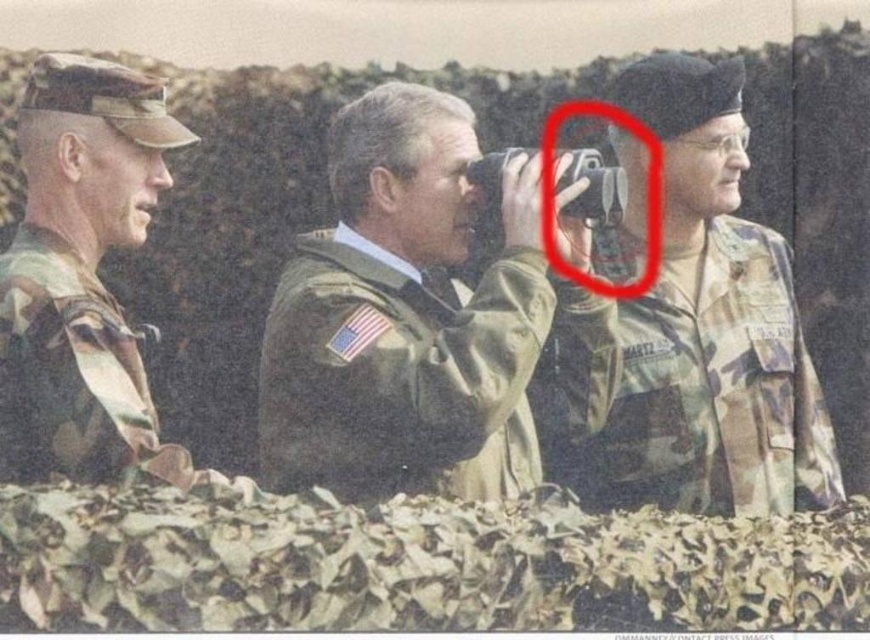
Is point (353, 100) farther from camera compared to point (168, 134)?

Yes.

Identify the location of camouflage jacket at center. (405, 317).

Locate an element on the screen. The width and height of the screenshot is (870, 640). camouflage jacket at center is located at coordinates (405, 317).

Measure the distance between point (717, 486) and camera.

A distance of 6.33 meters exists between point (717, 486) and camera.

Is camo fabric uniform at center wider than camo uniform at left?

Yes, camo fabric uniform at center is wider than camo uniform at left.

Is point (696, 403) positioned after point (152, 93)?

Yes, it is.

The image size is (870, 640). I want to click on camo fabric uniform at center, so click(693, 392).

Can you confirm if camouflage jacket at center is shorter than camo fabric uniform at center?

No, camouflage jacket at center is not shorter than camo fabric uniform at center.

Does camouflage jacket at center have a lesser width compared to camo fabric uniform at center?

Correct, camouflage jacket at center's width is less than camo fabric uniform at center's.

Which is behind, point (273, 369) or point (747, 371)?

Point (747, 371)

Identify the location of camouflage jacket at center. The image size is (870, 640). (405, 317).